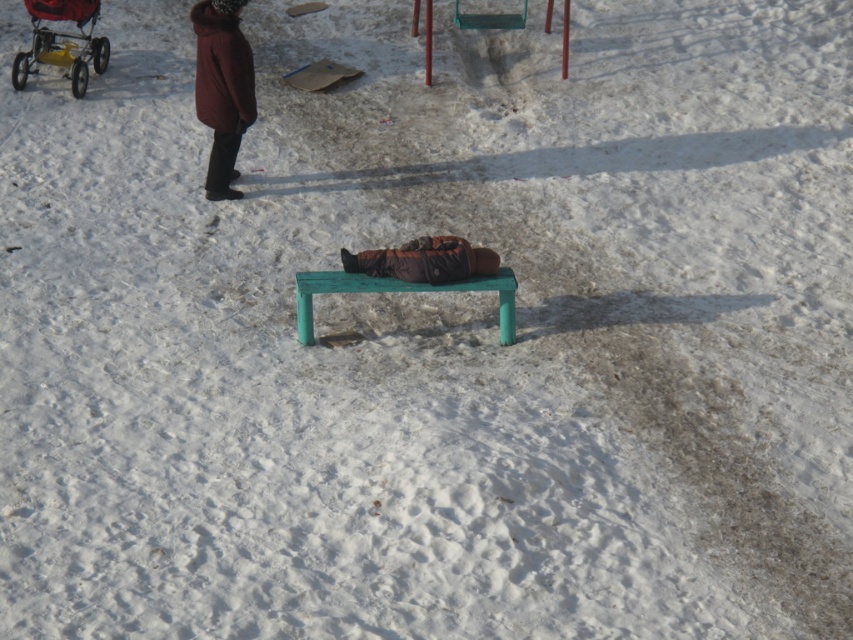
Question: Estimate the real-world distances between objects in this image. Which object is farther from the green plastic bench at center?

Choices:
 (A) burgundy wool coat at upper left
 (B) brown fuzzy coat at center

Answer: (A)

Question: Is burgundy wool coat at upper left above green plastic bench at center?

Choices:
 (A) no
 (B) yes

Answer: (B)

Question: Which object is farther from the camera taking this photo?

Choices:
 (A) green plastic bench at center
 (B) brown fuzzy coat at center
 (C) burgundy wool coat at upper left
 (D) yellow plastic baby carriage at upper left

Answer: (D)

Question: Where is yellow plastic baby carriage at upper left located in relation to brown fuzzy coat at center in the image?

Choices:
 (A) below
 (B) above

Answer: (B)

Question: Is yellow plastic baby carriage at upper left below brown fuzzy coat at center?

Choices:
 (A) no
 (B) yes

Answer: (A)

Question: Which of the following is the farthest from the observer?

Choices:
 (A) (308, 288)
 (B) (94, 65)
 (C) (235, 88)

Answer: (B)